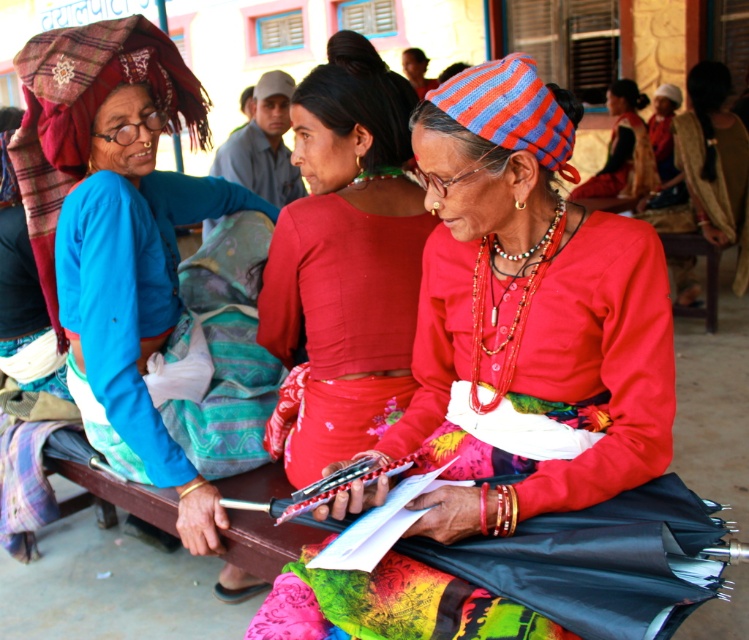
Question: Is matte blue shirt at left further to camera compared to red fabric skirt at center?

Choices:
 (A) no
 (B) yes

Answer: (A)

Question: Among these objects, which one is nearest to the camera?

Choices:
 (A) matte blue shirt at left
 (B) matte red blouse at center
 (C) red fabric skirt at center

Answer: (A)

Question: Among these points, which one is farthest from the camera?

Choices:
 (A) (627, 131)
 (B) (724, 240)
 (C) (291, 275)
 (D) (430, 451)

Answer: (A)

Question: Is matte blue shirt at left wider than red fabric skirt at center?

Choices:
 (A) no
 (B) yes

Answer: (A)

Question: Does matte red fabric at center have a smaller size compared to gold textured shawl at center?

Choices:
 (A) yes
 (B) no

Answer: (B)

Question: Which of the following is the farthest from the observer?

Choices:
 (A) gold textured shawl at center
 (B) matte red fabric at center
 (C) matte blue shirt at left
 (D) matte red blouse at center

Answer: (A)